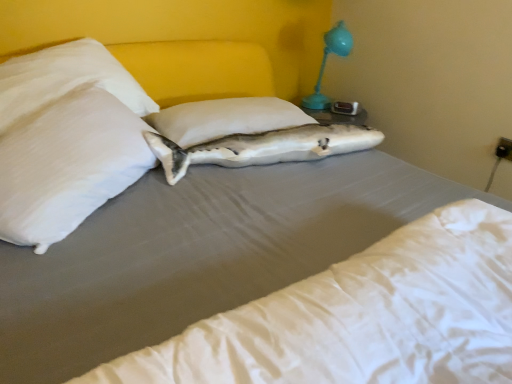
Question: Can you confirm if white smooth mattress at center is shorter than white matte fish at center?

Choices:
 (A) no
 (B) yes

Answer: (A)

Question: Considering the relative sizes of white smooth mattress at center and white matte fish at center in the image provided, is white smooth mattress at center wider than white matte fish at center?

Choices:
 (A) yes
 (B) no

Answer: (A)

Question: Is white matte fish at center surrounded by white smooth mattress at center?

Choices:
 (A) no
 (B) yes

Answer: (A)

Question: Considering the relative sizes of white smooth mattress at center and white matte fish at center in the image provided, is white smooth mattress at center bigger than white matte fish at center?

Choices:
 (A) yes
 (B) no

Answer: (A)

Question: Is white smooth mattress at center behind white matte fish at center?

Choices:
 (A) no
 (B) yes

Answer: (A)

Question: Relative to white matte fish at center, is white fabric pillow at center, the 2th pillow from the left, in front or behind?

Choices:
 (A) behind
 (B) front

Answer: (A)

Question: Does point (206, 127) appear closer or farther from the camera than point (367, 135)?

Choices:
 (A) farther
 (B) closer

Answer: (B)

Question: Looking at their shapes, would you say white fabric pillow at center, the 2th pillow from the left, is wider or thinner than white matte fish at center?

Choices:
 (A) wide
 (B) thin

Answer: (A)

Question: In the image, is white fabric pillow at center, the 2th pillow from the left, on the left side or the right side of white matte fish at center?

Choices:
 (A) right
 (B) left

Answer: (B)

Question: In the image, is white matte fish at center on the left side or the right side of matte blue plastic lamp at upper right?

Choices:
 (A) left
 (B) right

Answer: (A)

Question: Is point (308, 130) closer or farther from the camera than point (311, 99)?

Choices:
 (A) closer
 (B) farther

Answer: (A)

Question: From a real-world perspective, is white matte fish at center positioned above or below matte blue plastic lamp at upper right?

Choices:
 (A) above
 (B) below

Answer: (B)

Question: Looking at the image, does white matte fish at center seem bigger or smaller compared to matte blue plastic lamp at upper right?

Choices:
 (A) big
 (B) small

Answer: (B)

Question: Does point (497, 360) appear closer or farther from the camera than point (118, 173)?

Choices:
 (A) farther
 (B) closer

Answer: (B)

Question: Is white smooth mattress at center inside the boundaries of white satin pillow at upper left, arranged as the 1th pillow when viewed from the left, or outside?

Choices:
 (A) inside
 (B) outside

Answer: (B)